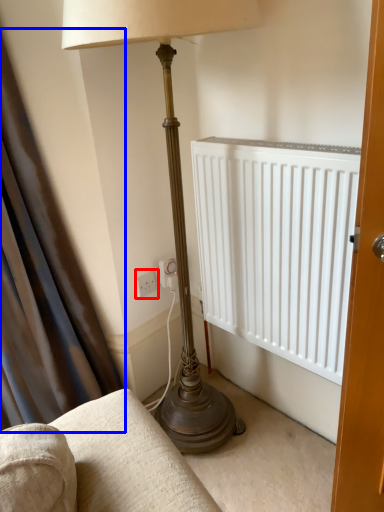
Question: Among these objects, which one is farthest to the camera, electric outlet (highlighted by a red box) or curtain (highlighted by a blue box)?

Choices:
 (A) electric outlet
 (B) curtain

Answer: (A)